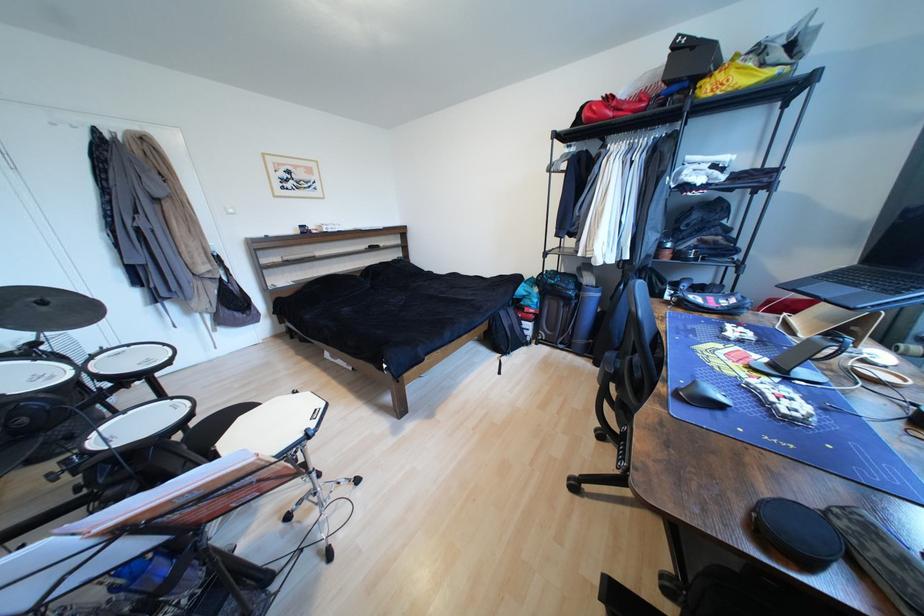
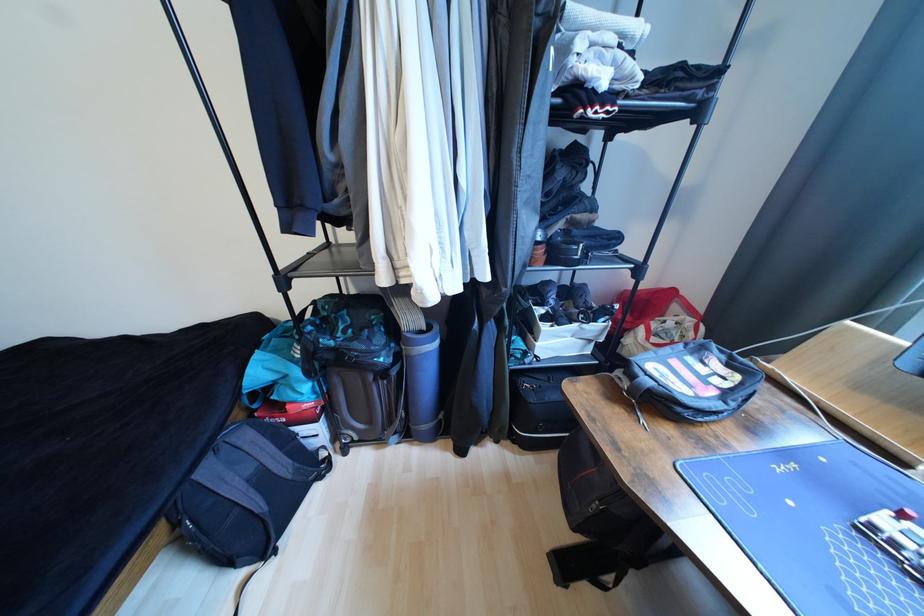
Find the pixel in the second image that matches the point at 508,315 in the first image.

(215, 472)